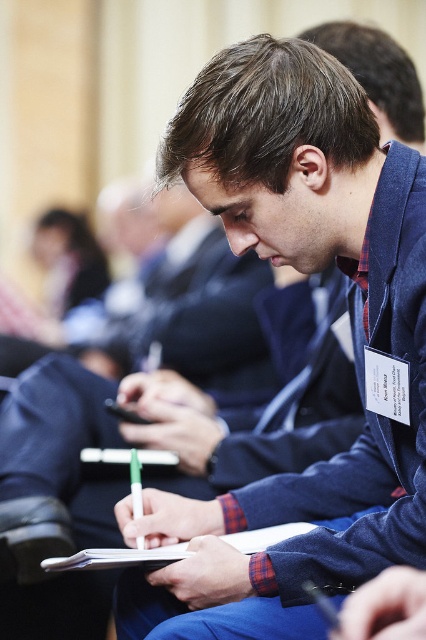
Between blue fabric jacket at center and white paper clipboard at center, which one appears on the left side from the viewer's perspective?

white paper clipboard at center

Who is shorter, blue fabric jacket at center or white paper clipboard at center?

With less height is white paper clipboard at center.

Who is more distant from viewer, (209, 534) or (149, 554)?

The point (209, 534) is behind.

You are a GUI agent. You are given a task and a screenshot of the screen. Output one action in this format:
    pyautogui.click(x=<x>, y=<y>)
    Task: Click on the blue fabric jacket at center
    
    Given the screenshot: What is the action you would take?
    pyautogui.click(x=351, y=336)